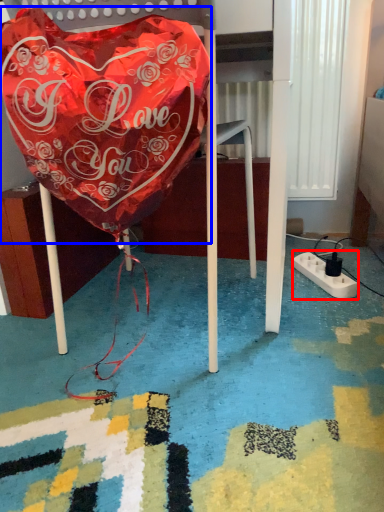
Question: Which object appears farthest to the camera in this image, extension cord (highlighted by a red box) or blanket (highlighted by a blue box)?

Choices:
 (A) extension cord
 (B) blanket

Answer: (A)